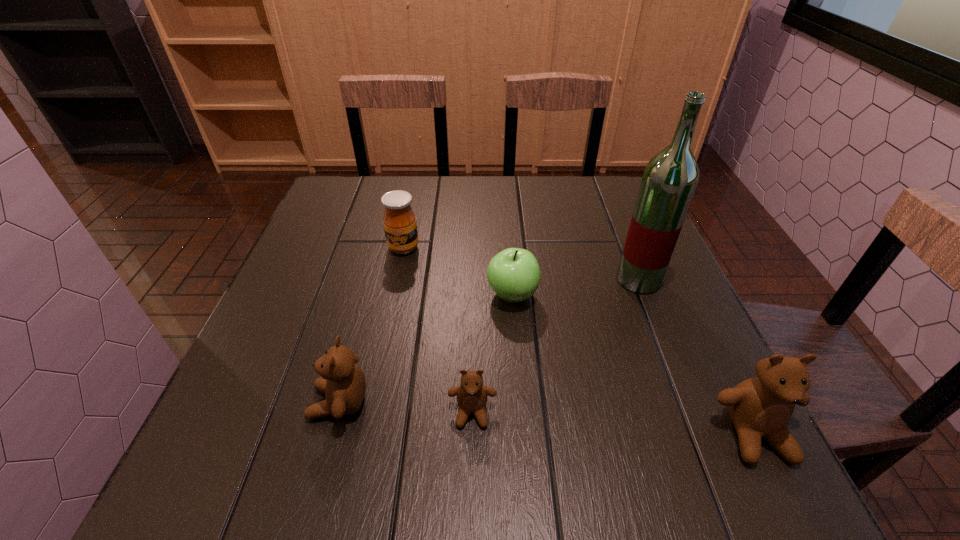
To make them evenly spaced by inserting another teddy_bear among them, please locate a vacant spot for this new teddy_bear. Please provide its 2D coordinates. Your answer should be formatted as a tuple, i.e. [(x, y)], where the tuple contains the x and y coordinates of a point satisfying the conditions above.

[(611, 423)]